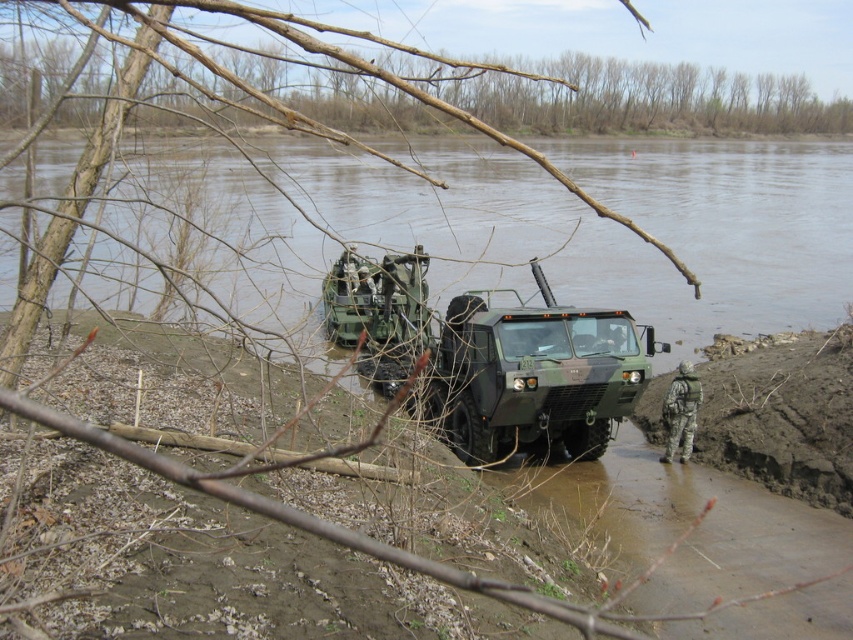
Question: Which point is closer to the camera?

Choices:
 (A) green matte military truck at center
 (B) brown bark tree at upper center

Answer: (B)

Question: Which of the following is the farthest from the observer?

Choices:
 (A) (593, 64)
 (B) (410, 304)

Answer: (A)

Question: Does green matte military truck at center have a larger size compared to brown bark tree at upper center?

Choices:
 (A) yes
 (B) no

Answer: (B)

Question: Which object is closer to the camera taking this photo?

Choices:
 (A) green matte military truck at center
 (B) brown bark tree at upper center

Answer: (B)

Question: Does green matte military truck at center have a greater width compared to brown bark tree at upper center?

Choices:
 (A) yes
 (B) no

Answer: (B)

Question: Observing the image, what is the correct spatial positioning of green matte military truck at center in reference to brown bark tree at upper center?

Choices:
 (A) left
 (B) right

Answer: (A)